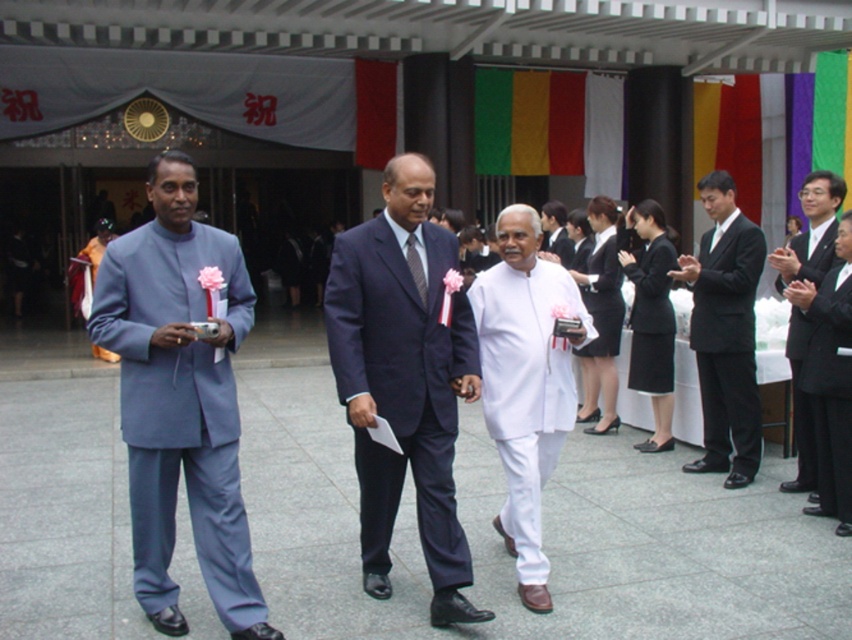
Question: Is black glossy suit at right to the left of black smooth suit at right from the viewer's perspective?

Choices:
 (A) yes
 (B) no

Answer: (A)

Question: Can you confirm if dark blue suit at center is positioned above black smooth suit at right?

Choices:
 (A) no
 (B) yes

Answer: (B)

Question: Which point is closer to the camera taking this photo?

Choices:
 (A) (144, 266)
 (B) (551, 212)
 (C) (505, 211)

Answer: (A)

Question: Estimate the real-world distances between objects in this image. Which object is closer to the white cotton kurta at center?

Choices:
 (A) black glossy suit at right
 (B) dark blue suit at center

Answer: (B)

Question: Observing the image, what is the correct spatial positioning of white cotton kurta at center in reference to white cotton robe at center?

Choices:
 (A) right
 (B) left

Answer: (B)

Question: Which of these objects is positioned closest to the black smooth suit at right?

Choices:
 (A) black glossy suit at right
 (B) dark blue suit at center
 (C) matte blue suit at left

Answer: (A)